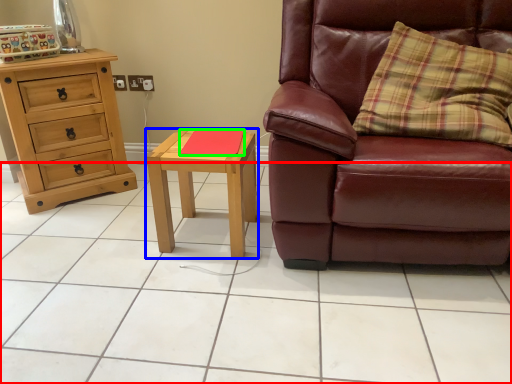
Question: Estimate the real-world distances between objects in this image. Which object is closer to ceramic tile (highlighted by a red box), nightstand (highlighted by a blue box) or pad (highlighted by a green box)?

Choices:
 (A) nightstand
 (B) pad

Answer: (A)